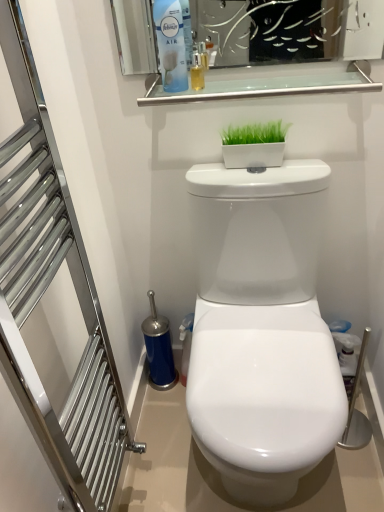
Question: Is blue plastic air freshener at upper center completely or partially outside of white glossy rectangular planter at upper center?

Choices:
 (A) no
 (B) yes

Answer: (B)

Question: From the image's perspective, is blue plastic air freshener at upper center under white glossy rectangular planter at upper center?

Choices:
 (A) no
 (B) yes

Answer: (A)

Question: Is blue plastic air freshener at upper center touching white glossy rectangular planter at upper center?

Choices:
 (A) yes
 (B) no

Answer: (B)

Question: Considering the relative positions of blue plastic air freshener at upper center and white glossy rectangular planter at upper center in the image provided, is blue plastic air freshener at upper center to the left of white glossy rectangular planter at upper center from the viewer's perspective?

Choices:
 (A) no
 (B) yes

Answer: (B)

Question: Can you confirm if blue plastic air freshener at upper center is wider than white glossy rectangular planter at upper center?

Choices:
 (A) yes
 (B) no

Answer: (A)

Question: From a real-world perspective, relative to brushed metal towel rack at left, is clear glass shelf at upper center vertically above or below?

Choices:
 (A) above
 (B) below

Answer: (A)

Question: Considering the positions of clear glass shelf at upper center and brushed metal towel rack at left in the image, is clear glass shelf at upper center wider or thinner than brushed metal towel rack at left?

Choices:
 (A) thin
 (B) wide

Answer: (B)

Question: Is clear glass shelf at upper center to the left or to the right of brushed metal towel rack at left in the image?

Choices:
 (A) left
 (B) right

Answer: (B)

Question: In the image, is clear glass shelf at upper center positioned in front of or behind brushed metal towel rack at left?

Choices:
 (A) behind
 (B) front

Answer: (A)

Question: Is blue plastic air freshener at upper center in front of or behind brushed metal towel rack at left in the image?

Choices:
 (A) behind
 (B) front

Answer: (A)

Question: From the image's perspective, is blue plastic air freshener at upper center positioned above or below brushed metal towel rack at left?

Choices:
 (A) above
 (B) below

Answer: (A)

Question: Is blue plastic air freshener at upper center spatially inside brushed metal towel rack at left, or outside of it?

Choices:
 (A) inside
 (B) outside

Answer: (B)

Question: In the image, is blue plastic air freshener at upper center on the left side or the right side of brushed metal towel rack at left?

Choices:
 (A) left
 (B) right

Answer: (B)

Question: From their relative heights in the image, would you say brushed metal towel rack at left is taller or shorter than clear glass shelf at upper center?

Choices:
 (A) short
 (B) tall

Answer: (B)

Question: From a real-world perspective, is brushed metal towel rack at left positioned above or below clear glass shelf at upper center?

Choices:
 (A) below
 (B) above

Answer: (A)